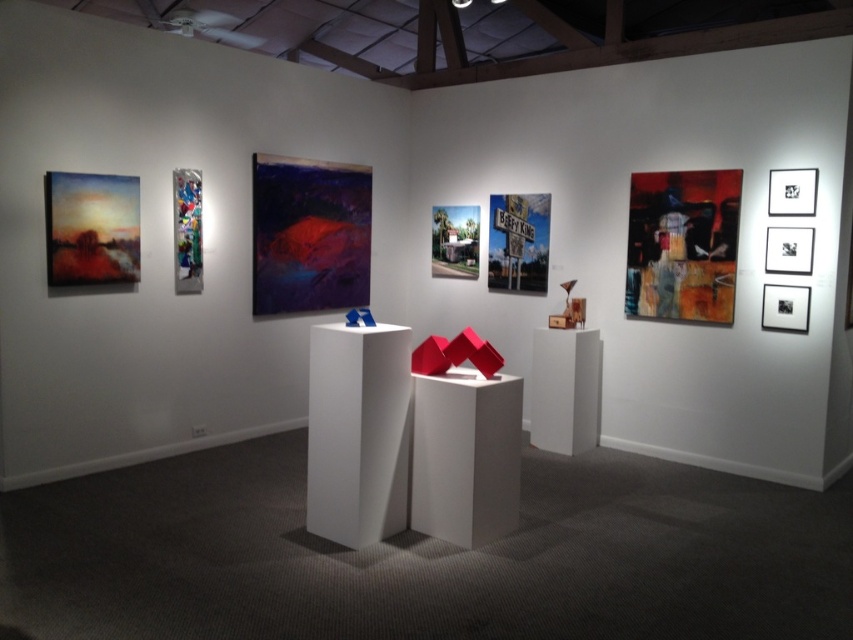
Question: Which point is closer to the camera taking this photo?

Choices:
 (A) (541, 216)
 (B) (329, 168)
 (C) (693, 172)
 (D) (74, 211)

Answer: (D)

Question: Among these objects, which one is farthest from the camera?

Choices:
 (A) metallic street sign at center
 (B) metallic silver sign at center
 (C) shiny metallic fish at center

Answer: (B)

Question: Based on their relative distances, which object is farther from the metallic street sign at center?

Choices:
 (A) metallic silver sign at center
 (B) abstract painting at upper right
 (C) metallic reflective sculpture at upper left
 (D) matte oil painting at left

Answer: (D)

Question: Is metallic street sign at center closer to the viewer compared to metallic reflective sculpture at upper left?

Choices:
 (A) yes
 (B) no

Answer: (B)

Question: Can you confirm if metallic reflective sculpture at upper left is positioned below metallic silver sign at center?

Choices:
 (A) no
 (B) yes

Answer: (B)

Question: Does shiny metallic fish at center have a greater width compared to abstract painting at upper right?

Choices:
 (A) no
 (B) yes

Answer: (B)